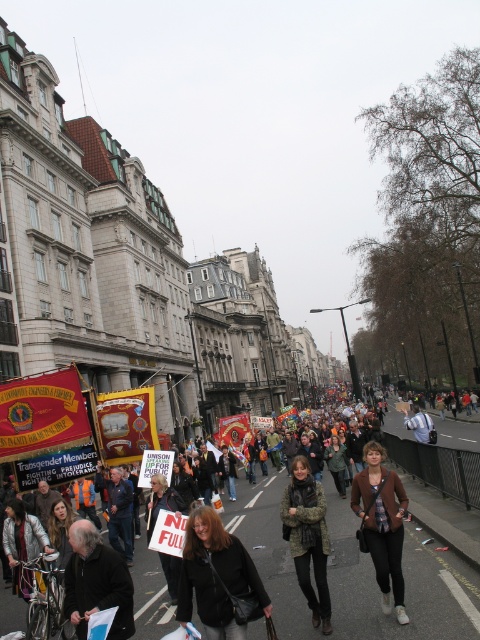
Who is shorter, brown fabric jacket at center or camouflage jacket at center?

camouflage jacket at center is shorter.

What do you see at coordinates (382, 524) in the screenshot?
I see `brown fabric jacket at center` at bounding box center [382, 524].

What are the coordinates of `brown fabric jacket at center` in the screenshot? It's located at (382, 524).

Measure the distance between camouflage jacket at center and camera.

camouflage jacket at center and camera are 126.32 feet apart.

Between camouflage jacket at center and white fabric sign at center, which one is positioned higher?

camouflage jacket at center is above.

Between point (321, 532) and point (155, 513), which one is positioned in front?

Point (321, 532)

The width and height of the screenshot is (480, 640). In order to click on camouflage jacket at center in this screenshot , I will do `click(308, 538)`.

Does black leather jacket at center have a lesser width compared to brown fabric jacket at center?

No.

Is black leather jacket at center positioned before brown fabric jacket at center?

Yes, it is.

Is point (192, 516) in front of point (374, 540)?

Yes.

In order to click on black leather jacket at center in this screenshot , I will do `click(216, 577)`.